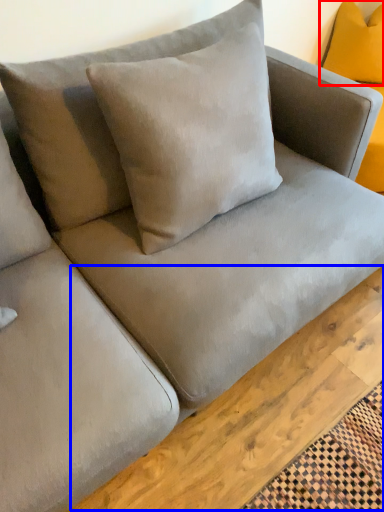
Question: Among these objects, which one is nearest to the camera, pillow (highlighted by a red box) or plank (highlighted by a blue box)?

Choices:
 (A) pillow
 (B) plank

Answer: (B)